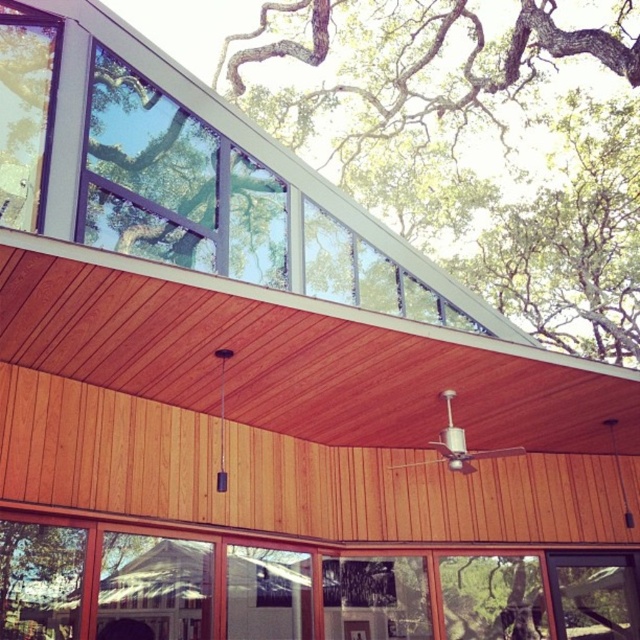
You are an architect inspecting the building. You notice the green leafy tree at upper center and the clear glass window at center. Which object is taller?

The green leafy tree at upper center is taller than the clear glass window at center according to the description.

You are standing at the entrance of the building and want to locate the clear glass windows at upper center. According to the coordinate system where the bottom left corner is the origin, what are their coordinates?

The clear glass windows at upper center are located at coordinates point [182,173].

You are standing in front of the modern architectural structure. You see two points marked on the building. The first is at point (637, 317) and the second is at point (1, 104). Which point is closer to you?

Point (1, 104) is closer to you because it is less further to the camera than point (637, 317).